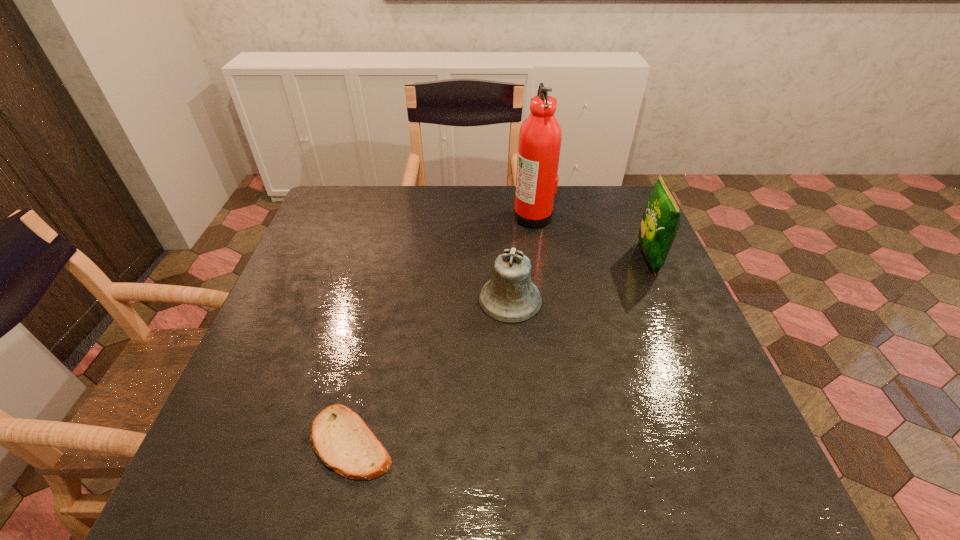
Image resolution: width=960 pixels, height=540 pixels. Identify the location of the tallest object. (540, 137).

Locate an element on the screen. The height and width of the screenshot is (540, 960). the farthest object is located at coordinates (540, 137).

Where is `the rightmost object`? This screenshot has width=960, height=540. the rightmost object is located at coordinates (660, 223).

Locate an element on the screen. crisp (potato chip) is located at coordinates (660, 223).

You are a GUI agent. You are given a task and a screenshot of the screen. Output one action in this format:
    pyautogui.click(x=<x>, y=<y>)
    Task: Click on the bell
    The width and height of the screenshot is (960, 540).
    Given the screenshot: What is the action you would take?
    pyautogui.click(x=510, y=297)

This screenshot has height=540, width=960. Find the location of `the third tallest object`. the third tallest object is located at coordinates (510, 297).

You are a GUI agent. You are given a task and a screenshot of the screen. Output one action in this format:
    pyautogui.click(x=<x>, y=<y>)
    Task: Click on the nearest object
    This screenshot has height=540, width=960.
    Given the screenshot: What is the action you would take?
    pyautogui.click(x=341, y=439)

I want to click on the leftmost object, so click(x=341, y=439).

I want to click on vacant space located on the label side of the farthest object, so click(400, 215).

Where is `vacant space located on the label side of the farthest object`? This screenshot has height=540, width=960. vacant space located on the label side of the farthest object is located at coordinates (487, 215).